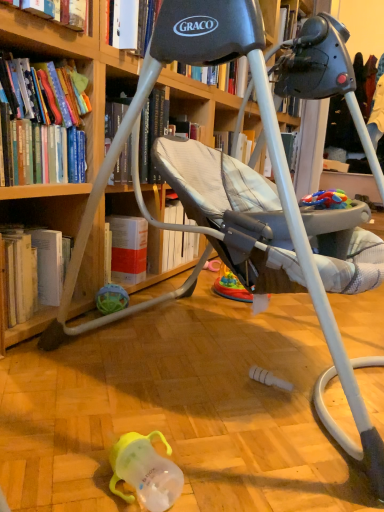
Image resolution: width=384 pixels, height=512 pixels. What are the coordinates of `vacant space underneath wooden bookcase at upper left (from a real-world perspective)` in the screenshot? It's located at (246, 366).